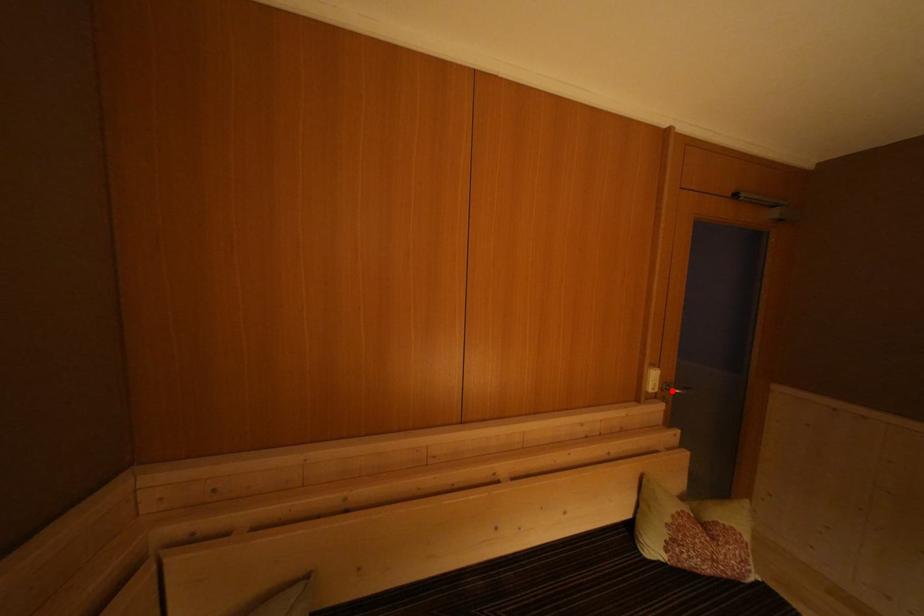
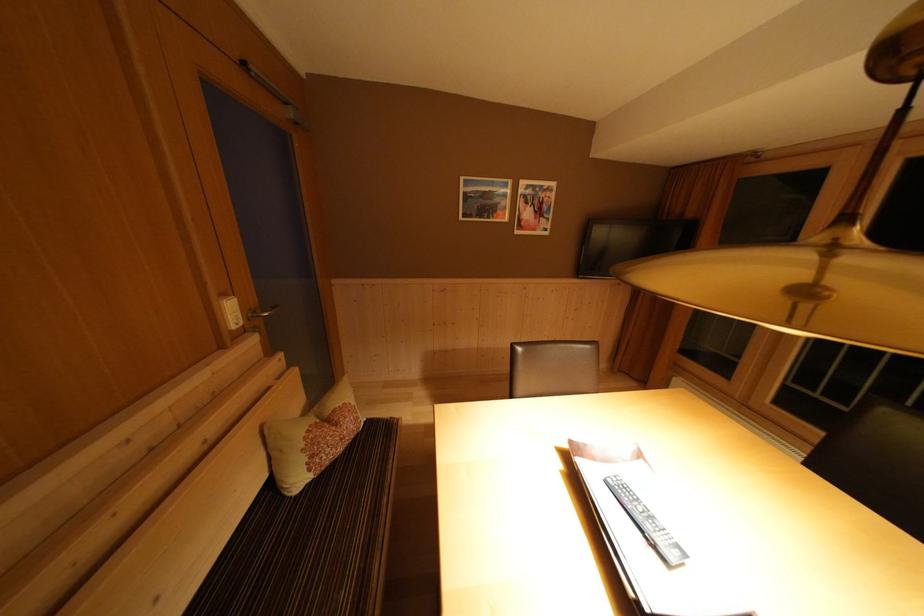
Locate, in the second image, the point that corresponds to the highlighted location in the first image.

(257, 318)